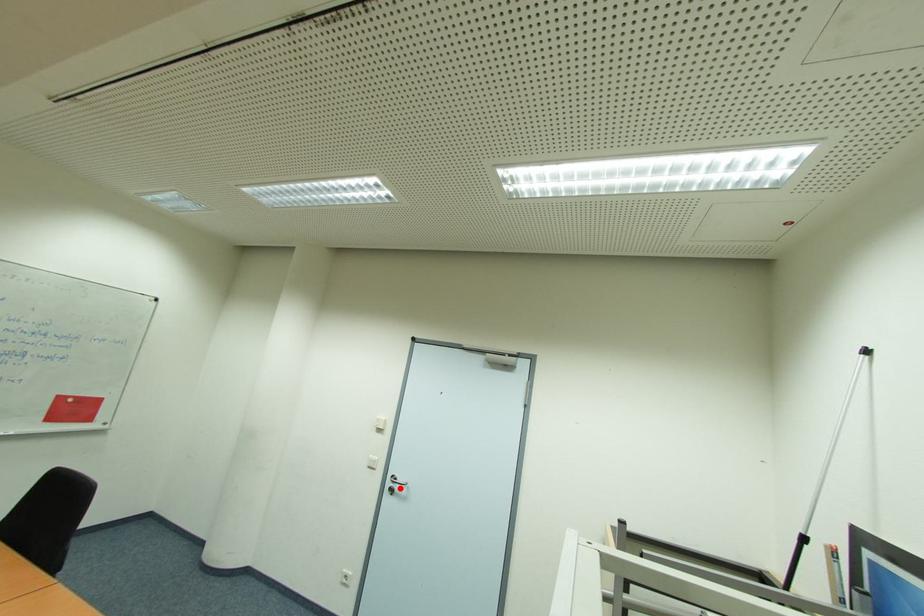
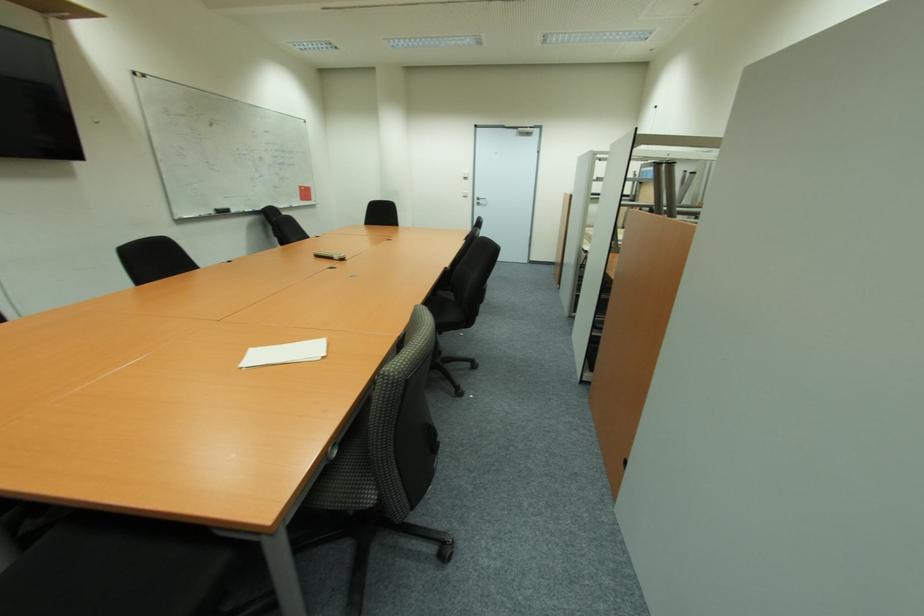
Question: I am providing you with two images of the same scene from different viewpoints. Image1 has a red point marked. In image2, the corresponding 3D location appears at what relative position? Reply with the corresponding letter.

Choices:
 (A) Closer
 (B) Farther

Answer: (A)